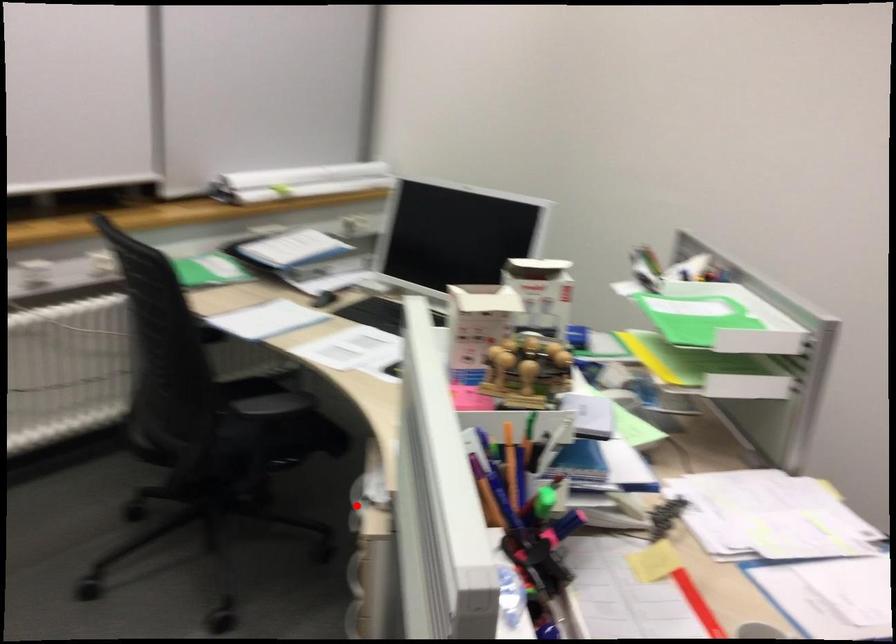
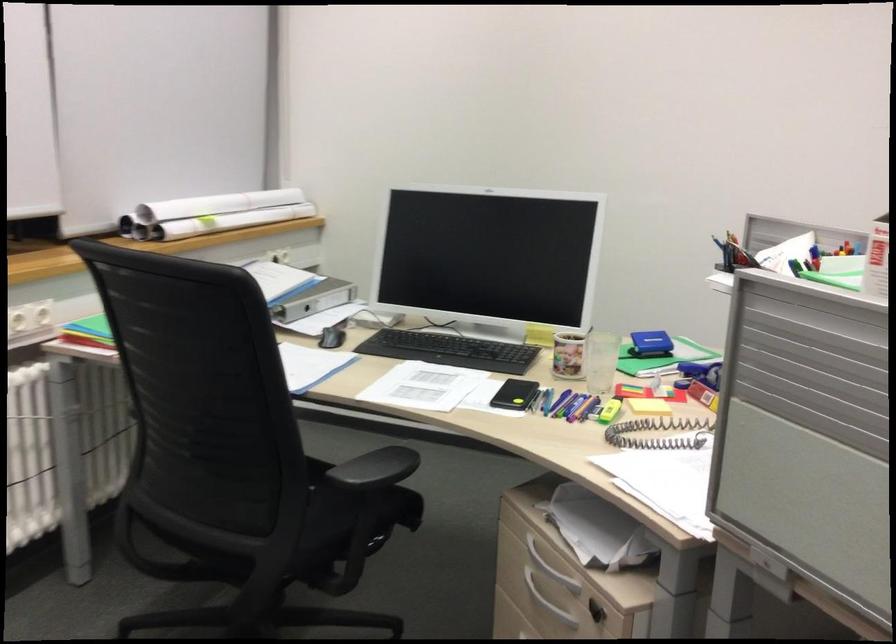
Locate, in the second image, the point that corresponds to the highlighted location in the first image.

(550, 567)